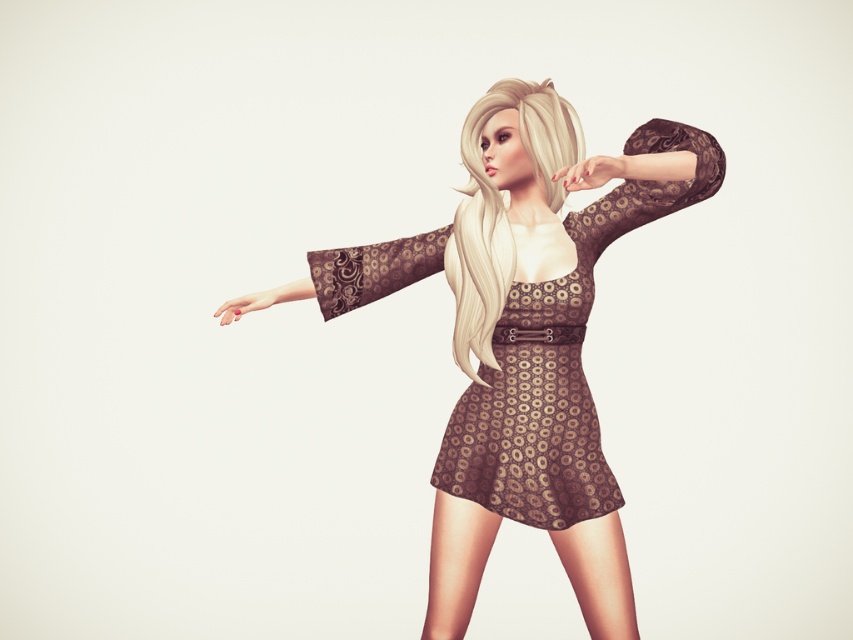
Which of these two, brown textured dress at center or brown lace sleeve at center, stands taller?

With more height is brown textured dress at center.

Is brown textured dress at center positioned behind brown lace sleeve at center?

No, it is not.

What do you see at coordinates (524, 340) in the screenshot? I see `brown textured dress at center` at bounding box center [524, 340].

Where is `brown textured dress at center`? This screenshot has width=853, height=640. brown textured dress at center is located at coordinates [x=524, y=340].

Between brown textured dress at center and brown lace sleeve at upper center, which one appears on the left side from the viewer's perspective?

brown textured dress at center is more to the left.

Which is above, brown textured dress at center or brown lace sleeve at upper center?

Positioned higher is brown lace sleeve at upper center.

In order to click on brown textured dress at center in this screenshot , I will do `click(524, 340)`.

Does brown lace sleeve at upper center lie in front of brown lace sleeve at center?

Yes, brown lace sleeve at upper center is in front of brown lace sleeve at center.

Is point (647, 193) farther from camera compared to point (361, 262)?

That is False.

Which is behind, point (677, 189) or point (370, 285)?

The point (370, 285) is behind.

The width and height of the screenshot is (853, 640). I want to click on brown lace sleeve at upper center, so [x=648, y=186].